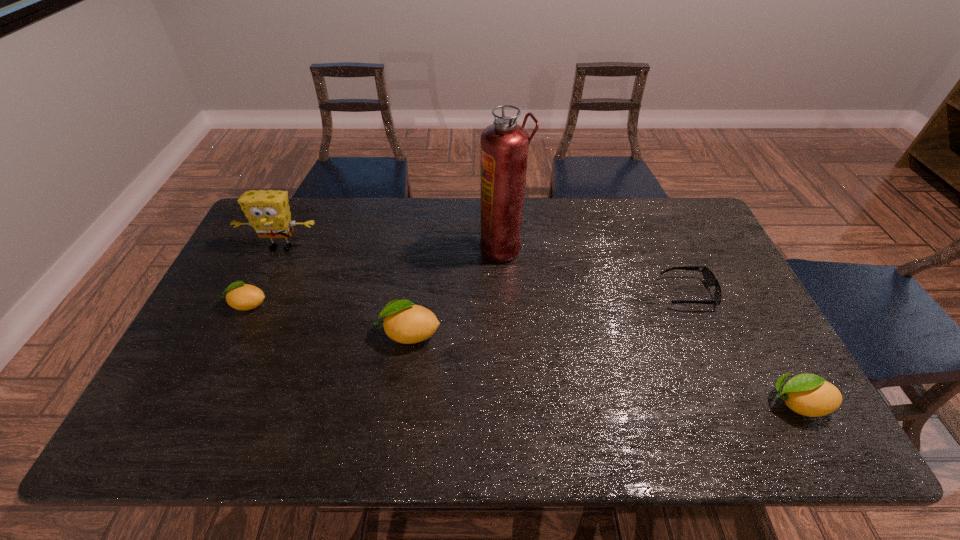
The image size is (960, 540). Identify the location of the shortest lemon. (241, 296).

This screenshot has height=540, width=960. What are the coordinates of `the leftmost lemon` in the screenshot? It's located at (241, 296).

The image size is (960, 540). In order to click on the second lemon from right to left in this screenshot , I will do (404, 322).

This screenshot has height=540, width=960. Identify the location of the second nearest lemon. (404, 322).

You are a GUI agent. You are given a task and a screenshot of the screen. Output one action in this format:
    pyautogui.click(x=<x>, y=<y>)
    Task: Click on the third shortest object
    The width and height of the screenshot is (960, 540).
    Given the screenshot: What is the action you would take?
    pyautogui.click(x=807, y=394)

Find the location of `the nearest lemon`. the nearest lemon is located at coordinates (807, 394).

Locate an element on the screen. Image resolution: width=960 pixels, height=540 pixels. the shortest object is located at coordinates (709, 278).

At what (x,y) coordinates should I click in order to perform the action: click on fire extinguisher. Please return your answer as a coordinate pair (x, y). The height and width of the screenshot is (540, 960). Looking at the image, I should click on (504, 145).

At what (x,y) coordinates should I click in order to perform the action: click on the third object from right to left. Please return your answer as a coordinate pair (x, y). This screenshot has height=540, width=960. Looking at the image, I should click on (504, 145).

Find the location of `the fifth shortest object`. the fifth shortest object is located at coordinates (268, 212).